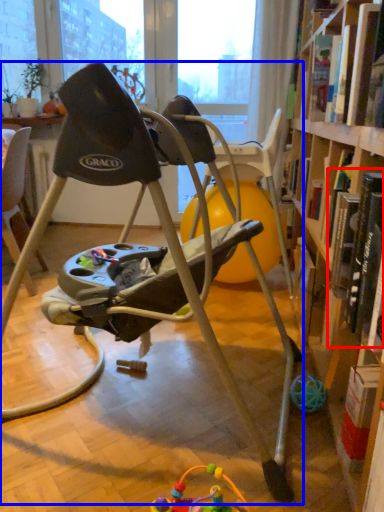
Question: Which point is closer to the camera, book (highlighted by a red box) or chair (highlighted by a blue box)?

Choices:
 (A) book
 (B) chair

Answer: (B)